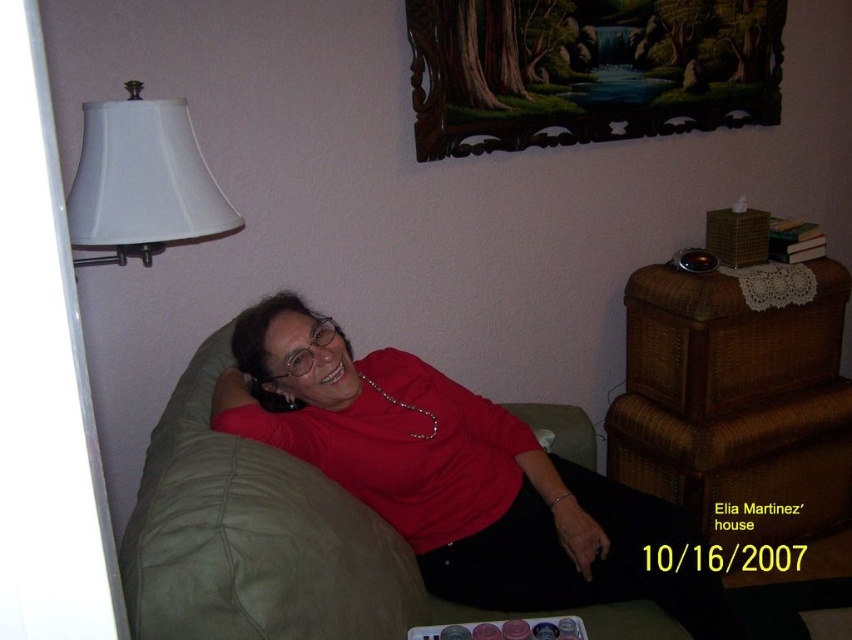
Question: Can you confirm if dark wood picture frame at upper center is positioned above silver metallic necklace at center?

Choices:
 (A) yes
 (B) no

Answer: (A)

Question: Which of the following is the farthest from the observer?

Choices:
 (A) (160, 186)
 (B) (426, 484)
 (C) (413, 408)
 (D) (486, 36)

Answer: (D)

Question: Does matte red blouse at center lie behind silver metallic necklace at center?

Choices:
 (A) no
 (B) yes

Answer: (A)

Question: Which point is closer to the camera?

Choices:
 (A) white fabric lampshade at upper left
 (B) silver metallic necklace at center
 (C) matte red blouse at center

Answer: (A)

Question: Can you confirm if dark wood picture frame at upper center is wider than silver metallic necklace at center?

Choices:
 (A) yes
 (B) no

Answer: (A)

Question: Which object is closer to the camera taking this photo?

Choices:
 (A) white fabric lampshade at upper left
 (B) matte red blouse at center
 (C) silver metallic necklace at center
 (D) dark wood picture frame at upper center

Answer: (A)